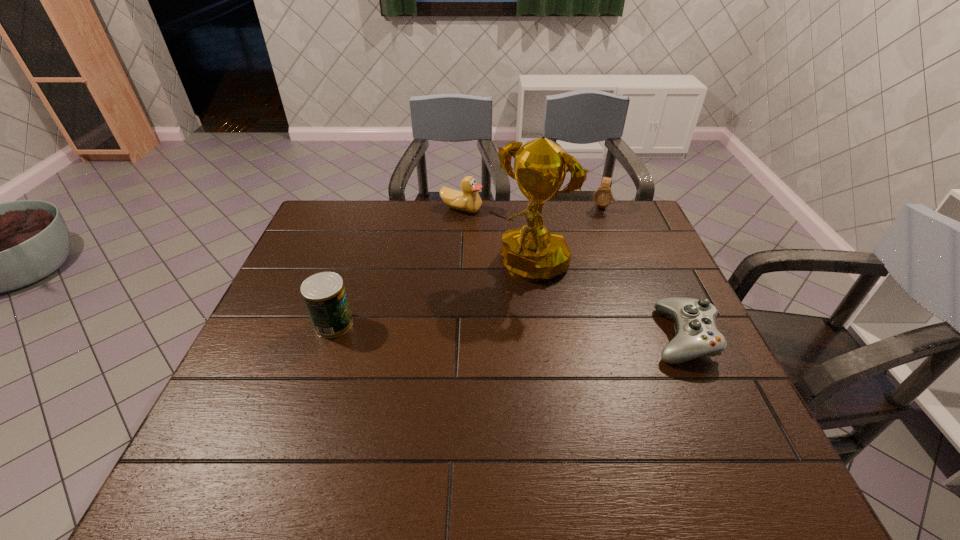
The height and width of the screenshot is (540, 960). Identify the location of free location that satisfies the following two spatial constraints: 1. on the front side of the watch; 2. on the left side of the shortest object. (649, 336).

The image size is (960, 540). Identify the location of vacant region that satisfies the following two spatial constraints: 1. on the front side of the third farthest object; 2. on the right side of the duck. (458, 264).

Image resolution: width=960 pixels, height=540 pixels. What are the coordinates of `vacant position in the image that satisfies the following two spatial constraints: 1. on the front side of the shortest object; 2. on the left side of the watch` in the screenshot? It's located at (649, 336).